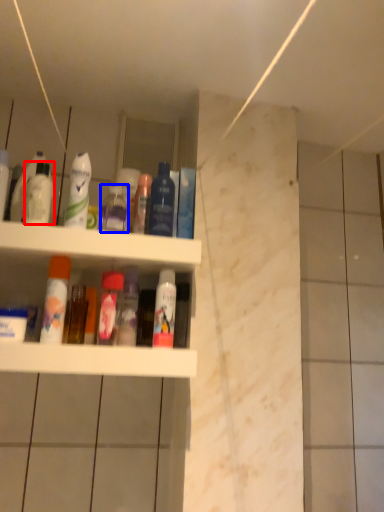
Question: Which point is closer to the camera, mouthwash (highlighted by a red box) or cleaning product (highlighted by a blue box)?

Choices:
 (A) mouthwash
 (B) cleaning product

Answer: (A)